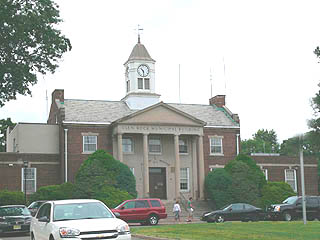
At what (x,y) coordinates should I click in order to perform the action: click on library. Please return your answer as a coordinate pair (x, y). The height and width of the screenshot is (240, 320). Looking at the image, I should click on (170, 147).